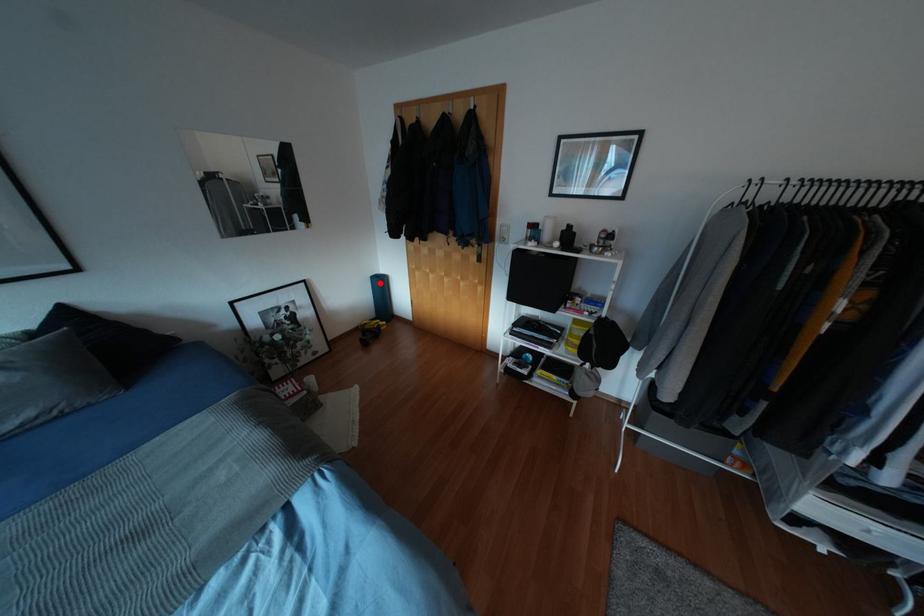
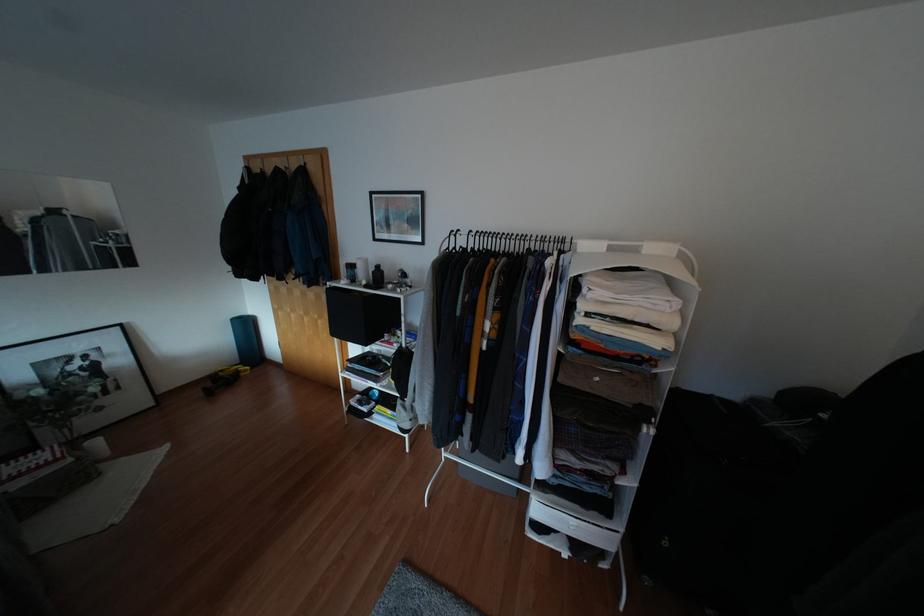
Locate, in the second image, the point that corresponds to the highlighted location in the first image.

(246, 325)